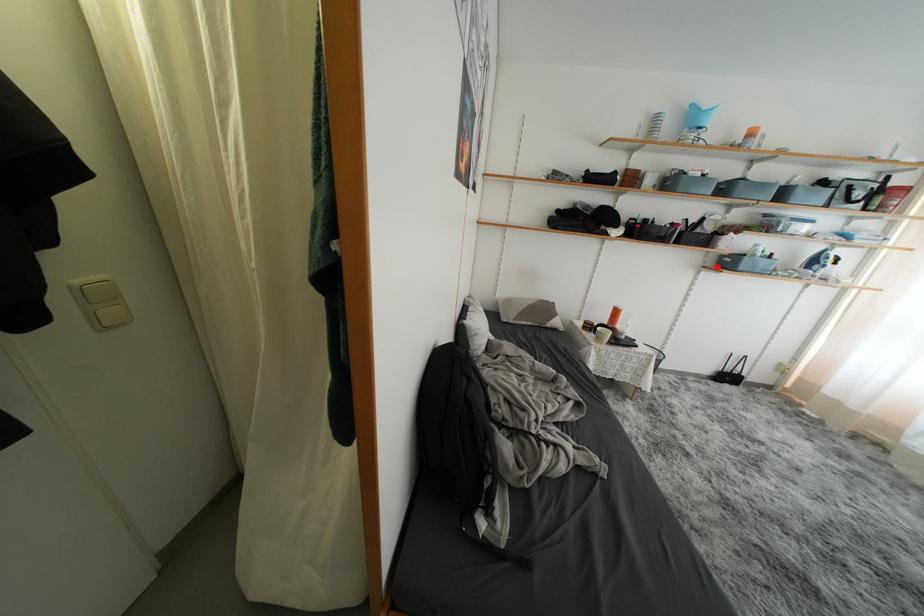
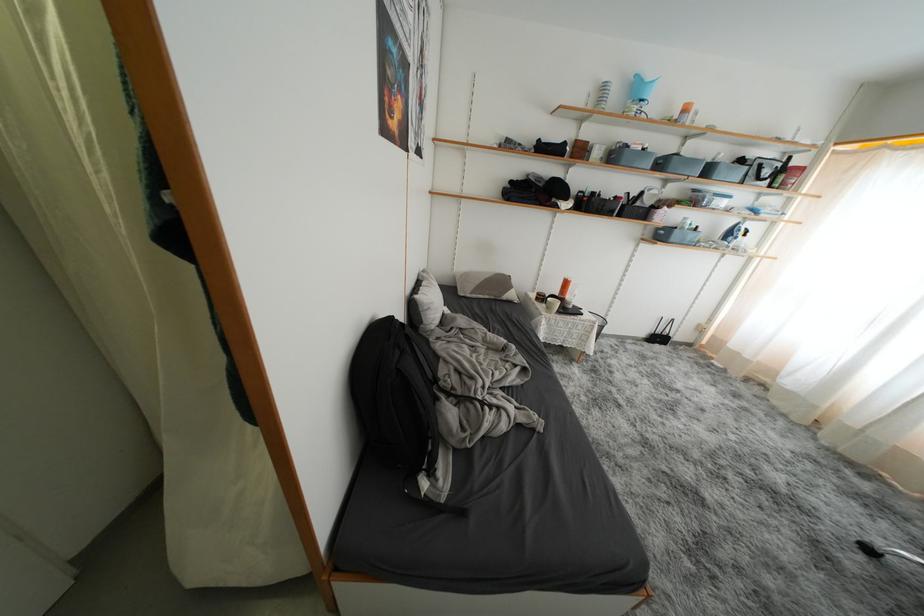
Find the pixel in the second image that matches the highlighted location in the first image.

(654, 238)